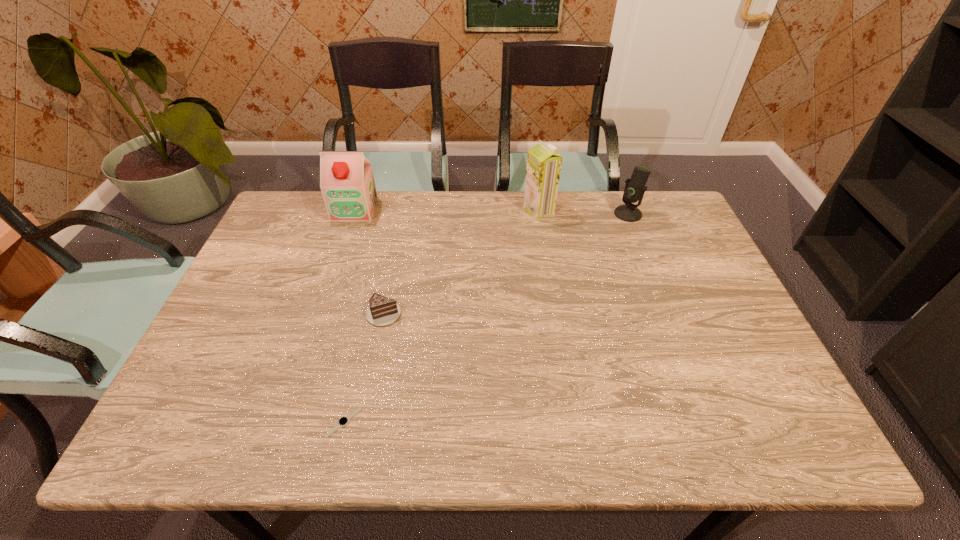
You are a GUI agent. You are given a task and a screenshot of the screen. Output one action in this format:
    pyautogui.click(x=<x>, y=<y>)
    Task: Click on the right soya milk
    Image resolution: width=960 pixels, height=540 pixels.
    Given the screenshot: What is the action you would take?
    pyautogui.click(x=544, y=163)

This screenshot has height=540, width=960. In order to click on the leftmost object in this screenshot , I will do `click(347, 184)`.

The width and height of the screenshot is (960, 540). Identify the location of microphone. (635, 188).

Find the location of `the third tallest object`. the third tallest object is located at coordinates (635, 188).

Find the location of `chocolate cake`. chocolate cake is located at coordinates (382, 311).

I want to click on the fourth farthest object, so click(382, 311).

Identify the location of the shortest object. Image resolution: width=960 pixels, height=540 pixels. (343, 421).

I want to click on watch, so click(343, 421).

The height and width of the screenshot is (540, 960). I want to click on vacant space situated on the front of the right soya milk, so click(x=544, y=246).

Image resolution: width=960 pixels, height=540 pixels. I want to click on vacant space located with the cap open on the left soya milk, so click(x=318, y=318).